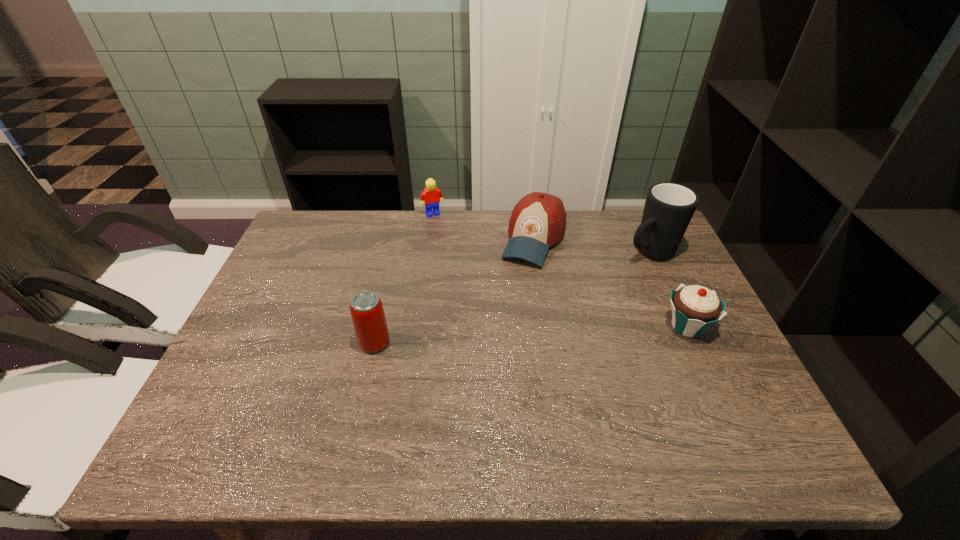
Image resolution: width=960 pixels, height=540 pixels. I want to click on mug that is at the right edge, so click(x=669, y=207).

You are a GUI agent. You are given a task and a screenshot of the screen. Output one action in this format:
    pyautogui.click(x=<x>, y=<y>)
    Task: Click on the object located at the far right corner
    This screenshot has height=540, width=960.
    Given the screenshot: What is the action you would take?
    pyautogui.click(x=669, y=207)

Find the location of a particular element. vacant space at the far edge of the desktop is located at coordinates (568, 255).

Locate an element on the screen. This screenshot has width=960, height=540. free space at the near edge of the desktop is located at coordinates (421, 413).

This screenshot has width=960, height=540. Identify the location of blank space at the left edge of the desktop. (262, 328).

This screenshot has height=540, width=960. In order to click on blank space at the right edge in this screenshot , I will do `click(652, 304)`.

In the image, there is a desktop. At what (x,y) coordinates should I click in order to perform the action: click on vacant region at the far left corner. Please return your answer as a coordinate pair (x, y). Looking at the image, I should click on (299, 235).

Image resolution: width=960 pixels, height=540 pixels. I want to click on vacant space at the near right corner of the desktop, so click(x=758, y=408).

What are the coordinates of `free space between the Lego and the beer can` in the screenshot? It's located at (404, 279).

Find the location of a particular element. The width and height of the screenshot is (960, 540). vacant point located between the third object from right to left and the second object from left to right is located at coordinates (483, 226).